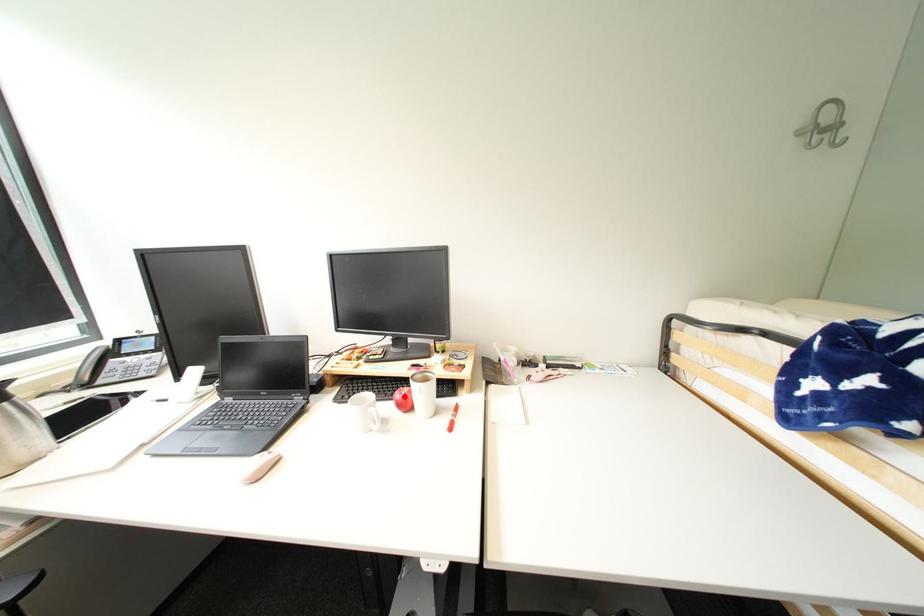
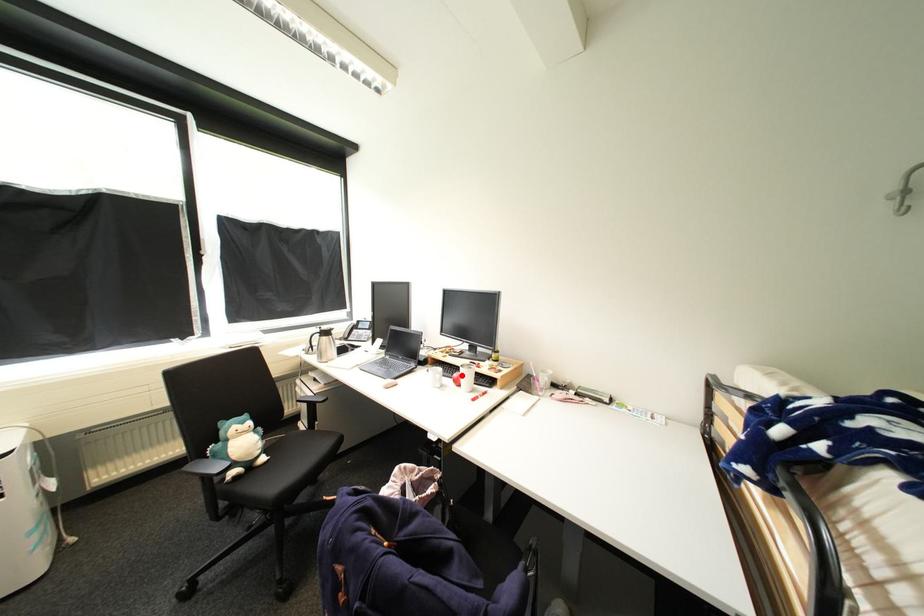
I am providing you with two images of the same scene from different viewpoints. A red point is marked on the first image and another point is marked on the second image. Are the points marked in image1 and image2 representing the same 3D position?

Yes